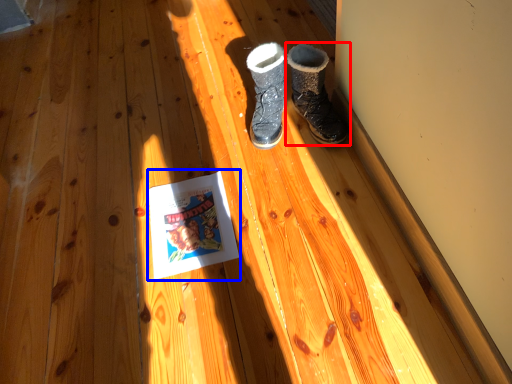
Question: Which object appears closest to the camera in this image, footwear (highlighted by a red box) or paperback book (highlighted by a blue box)?

Choices:
 (A) footwear
 (B) paperback book

Answer: (B)